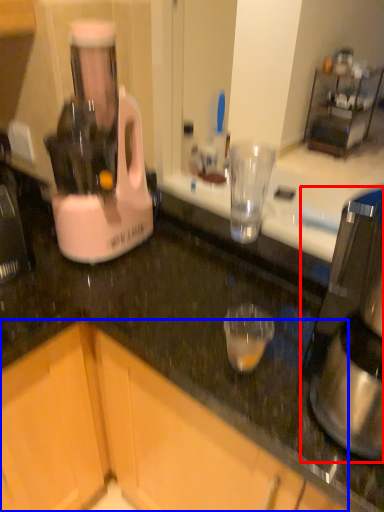
Question: Among these objects, which one is nearest to the camera, coffee maker (highlighted by a red box) or cabinetry (highlighted by a blue box)?

Choices:
 (A) coffee maker
 (B) cabinetry

Answer: (A)